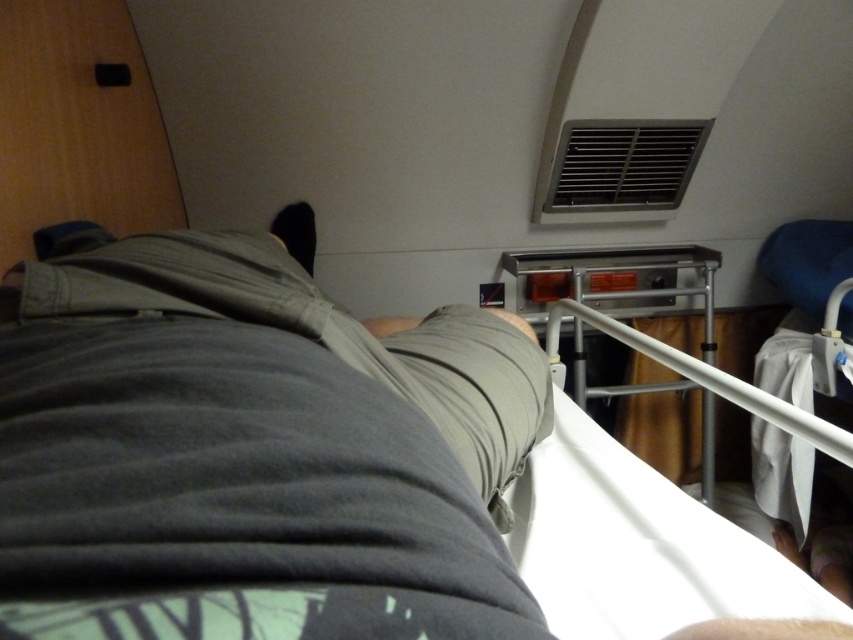
You are a nurse in a hospital room. You need to move a medical cart that is 1.2 meters wide through the space between the white plastic hospital bed at lower right and the metallic gray rail at center. Can the cart fit through the space?

The white plastic hospital bed at lower right has a smaller size compared to metallic gray rail at center, but the exact dimensions of the space between them are not provided. Without knowing the distance between the two objects, it is impossible to determine if the medical cart will fit through the space.

You are designing a new compartment layout for a train. You have to place both the gray cotton shorts at center and the metallic gray rail at center in the same area. Considering their sizes, which object should be placed closer to the edges to ensure they fit properly?

The gray cotton shorts at center has a lesser width compared to the metallic gray rail at center, so the gray cotton shorts at center should be placed closer to the edges to accommodate the wider metallic gray rail at center in the center area.